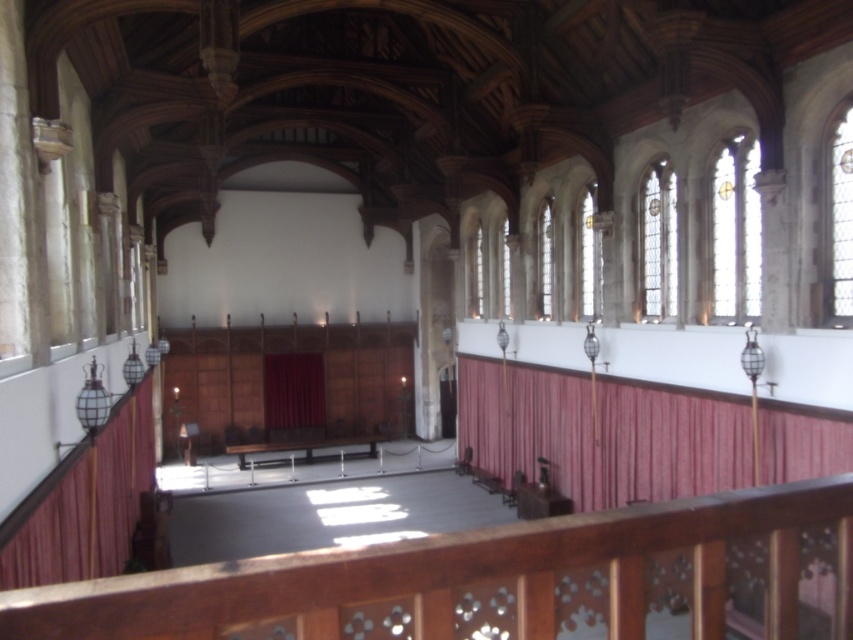
Question: Which object appears closest to the camera in this image?

Choices:
 (A) matte red curtain at left
 (B) velvet deep red curtain at center
 (C) velvet-like red curtain at center

Answer: (A)

Question: Can you confirm if matte red curtain at left is positioned below velvet deep red curtain at center?

Choices:
 (A) yes
 (B) no

Answer: (A)

Question: Is matte red curtain at left smaller than velvet deep red curtain at center?

Choices:
 (A) no
 (B) yes

Answer: (A)

Question: Which of these objects is positioned farthest from the velvet-like red curtain at center?

Choices:
 (A) matte red curtain at left
 (B) velvet deep red curtain at center

Answer: (A)

Question: Does matte red curtain at left have a greater width compared to velvet deep red curtain at center?

Choices:
 (A) yes
 (B) no

Answer: (A)

Question: Among these points, which one is nearest to the camera?

Choices:
 (A) (132, 432)
 (B) (308, 392)
 (C) (630, 401)

Answer: (C)